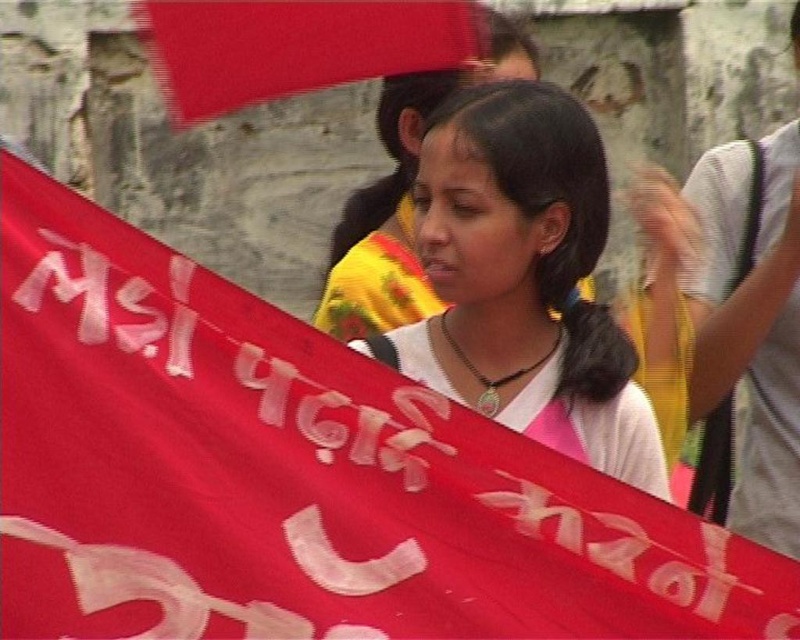
Question: Is white matte shirt at center to the right of matte red flag at upper center from the viewer's perspective?

Choices:
 (A) no
 (B) yes

Answer: (B)

Question: Which point is farther to the camera?

Choices:
 (A) (334, 42)
 (B) (510, 236)
 (C) (386, 132)

Answer: (C)

Question: Which point appears closest to the camera in this image?

Choices:
 (A) (360, 45)
 (B) (389, 88)

Answer: (A)

Question: Is white matte shirt at center in front of matte white shirt at center?

Choices:
 (A) yes
 (B) no

Answer: (A)

Question: Is matte red flag at upper center bigger than matte white shirt at center?

Choices:
 (A) no
 (B) yes

Answer: (A)

Question: Which point is farther from the camera taking this photo?

Choices:
 (A) (318, 81)
 (B) (498, 67)
 (C) (566, 392)

Answer: (B)